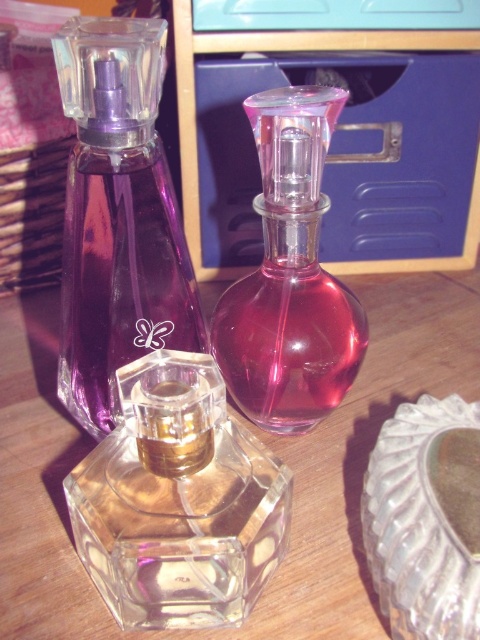
Does purple glass perfume at center have a greater width compared to pink glass perfume at center?

Incorrect, purple glass perfume at center's width does not surpass pink glass perfume at center's.

Between purple glass perfume at center and pink glass perfume at center, which one is positioned higher?

purple glass perfume at center is above.

Where is `purple glass perfume at center`? purple glass perfume at center is located at coordinates (118, 216).

Locate an element on the screen. purple glass perfume at center is located at coordinates (118, 216).

Looking at this image, between transparent glass perfume bottle at center and clear textured glass at center, which one is positioned higher?

transparent glass perfume bottle at center is above.

Does transparent glass perfume bottle at center have a larger size compared to clear textured glass at center?

Correct, transparent glass perfume bottle at center is larger in size than clear textured glass at center.

This screenshot has height=640, width=480. Describe the element at coordinates (260, 438) in the screenshot. I see `transparent glass perfume bottle at center` at that location.

Where is `transparent glass perfume bottle at center`? The width and height of the screenshot is (480, 640). transparent glass perfume bottle at center is located at coordinates (260, 438).

Which of these two, transparent glass perfume bottle at center or purple glass perfume at center, stands shorter?

transparent glass perfume bottle at center is shorter.

Which of these two, transparent glass perfume bottle at center or purple glass perfume at center, stands taller?

Standing taller between the two is purple glass perfume at center.

What do you see at coordinates (260, 438) in the screenshot?
I see `transparent glass perfume bottle at center` at bounding box center [260, 438].

Image resolution: width=480 pixels, height=640 pixels. What are the coordinates of `transparent glass perfume bottle at center` in the screenshot? It's located at (260, 438).